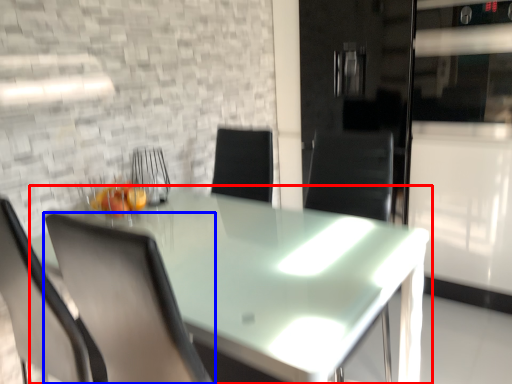
Question: Which point is further to the camera, table (highlighted by a red box) or chair (highlighted by a blue box)?

Choices:
 (A) table
 (B) chair

Answer: (B)